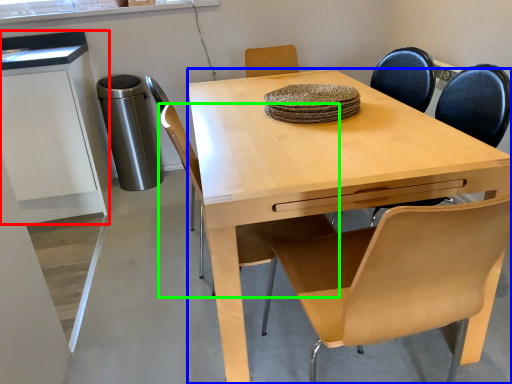
Question: Considering the real-world distances, which object is farthest from cabinetry (highlighted by a red box)? desk (highlighted by a blue box) or chair (highlighted by a green box)?

Choices:
 (A) desk
 (B) chair

Answer: (B)